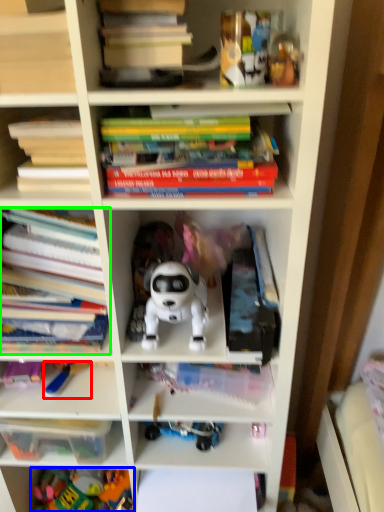
Question: Considering the real-world distances, which object is closest to toy (highlighted by a red box)? toy (highlighted by a blue box) or book (highlighted by a green box).

Choices:
 (A) toy
 (B) book

Answer: (B)